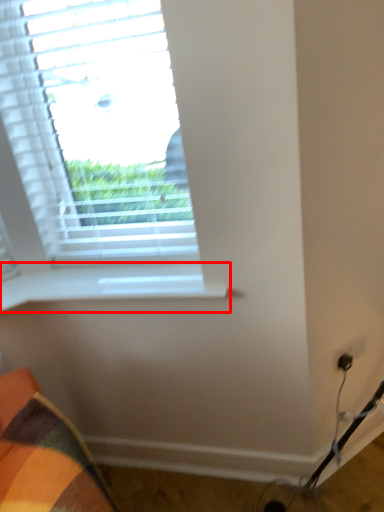
Question: From the image, what is the correct spatial relationship of window sill (annotated by the red box) in relation to window?

Choices:
 (A) right
 (B) left

Answer: (A)